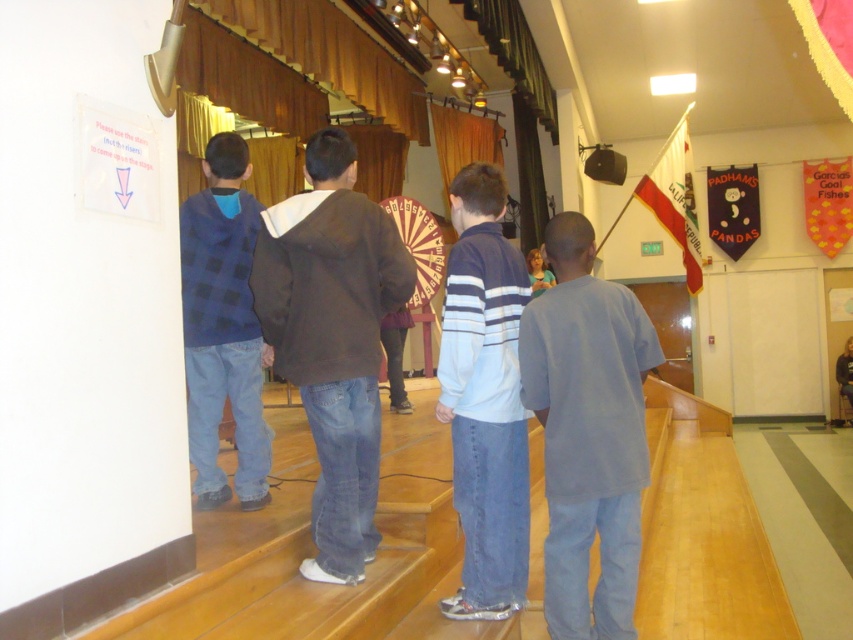
You are standing at the point labeled point (317,534) in the image and want to walk directly towards the viewer. How far will you have to walk to reach the viewer?

The distance between point (317,534) and the viewer is 3.15 meters, so you will have to walk 3.15 meters to reach the viewer.

You are a photographer setting up for a school event. You need to position a spotlight so it shines on both the dark brown hoodie at center and the blue plaid shirt at left without illuminating the other people. Based on their positions, where should you aim the spotlight?

The dark brown hoodie at center is below the blue plaid shirt at left, so aim the spotlight at the lower area where the dark brown hoodie at center is positioned and the upper area where the blue plaid shirt at left is located to avoid lighting the others.

You are an event planner arranging seating for a group photo. You need to place two chairs for the people wearing the blue striped sweater at center and the blue plaid shirt at left. According to the scene, which chair should be placed to the right of the other?

The blue striped sweater at center should be placed to the right of the blue plaid shirt at left because the blue striped sweater at center is to the right of the blue plaid shirt at left in the scene.